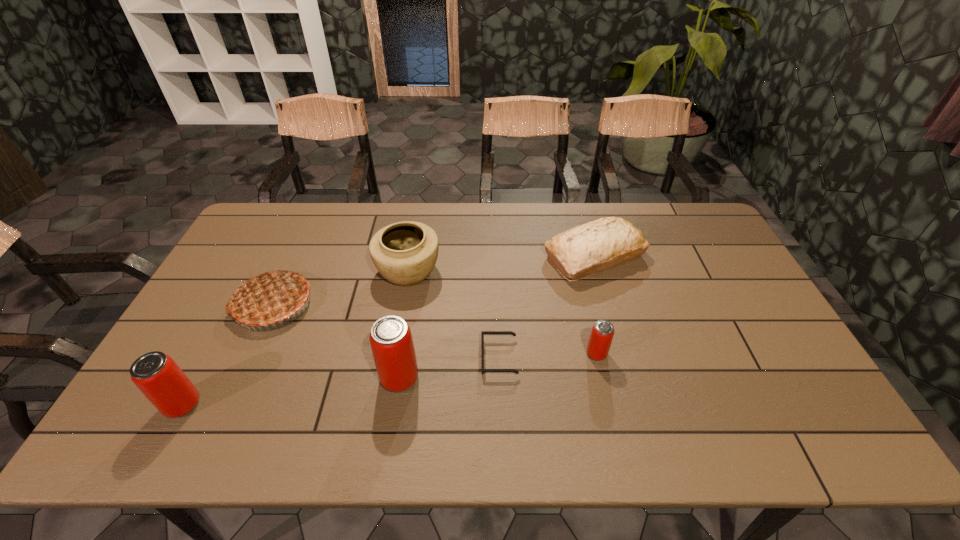
You are a GUI agent. You are given a task and a screenshot of the screen. Output one action in this format:
    pyautogui.click(x=<x>, y=<y>)
    Task: Click on the free space between the fifth object from left to right and the second tallest beer can
    This screenshot has width=960, height=540.
    Given the screenshot: What is the action you would take?
    pyautogui.click(x=341, y=381)

Find the location of a particular element. The height and width of the screenshot is (540, 960). vacant region between the shortest beer can and the bread is located at coordinates (595, 305).

You are a GUI agent. You are given a task and a screenshot of the screen. Output one action in this format:
    pyautogui.click(x=<x>, y=<y>)
    Task: Click on the vacant area that lies between the second beer can from left to right and the leftmost beer can
    The height and width of the screenshot is (540, 960).
    Given the screenshot: What is the action you would take?
    pyautogui.click(x=291, y=391)

Identify the location of free space between the bread and the sunglasses. (547, 307).

Where is `vacant space that is in between the sunglasses and the leftmost beer can`? The height and width of the screenshot is (540, 960). vacant space that is in between the sunglasses and the leftmost beer can is located at coordinates (341, 381).

I want to click on the second closest object to the bread, so click(x=483, y=333).

Choose which object is the nearest neighbor to the shortest object. Please provide its 2D coordinates. Your answer should be formatted as a tuple, i.e. [(x, y)], where the tuple contains the x and y coordinates of a point satisfying the conditions above.

[(391, 341)]

Identify the location of beer can that stands as the closest to the leftmost beer can. (391, 341).

At what (x,y) coordinates should I click in order to perform the action: click on beer can that is the third closest to the third object from right to left. Please return your answer as a coordinate pair (x, y). Looking at the image, I should click on [x=157, y=376].